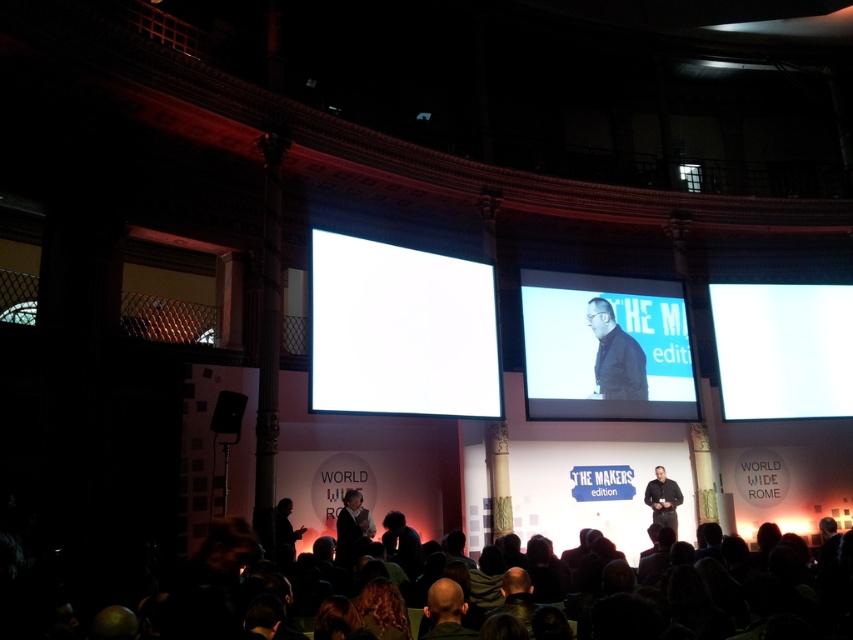
Question: Does white matte projection screen at center have a lesser width compared to bald head at lower center?

Choices:
 (A) no
 (B) yes

Answer: (A)

Question: Which of the following is the farthest from the observer?

Choices:
 (A) matte black screen at center
 (B) bald head at lower center

Answer: (A)

Question: Which object is the farthest from the black matte suit at center?

Choices:
 (A) white glossy projection screen at right
 (B) bald head at lower center
 (C) dark brown hair at lower center

Answer: (C)

Question: Is dark brown hair at lower center above dark brown leather jacket at center?

Choices:
 (A) yes
 (B) no

Answer: (B)

Question: Among these points, which one is nearest to the camera?

Choices:
 (A) (635, 384)
 (B) (351, 515)

Answer: (B)

Question: Can you confirm if matte black screen at center is positioned above dark brown hair at lower center?

Choices:
 (A) yes
 (B) no

Answer: (A)